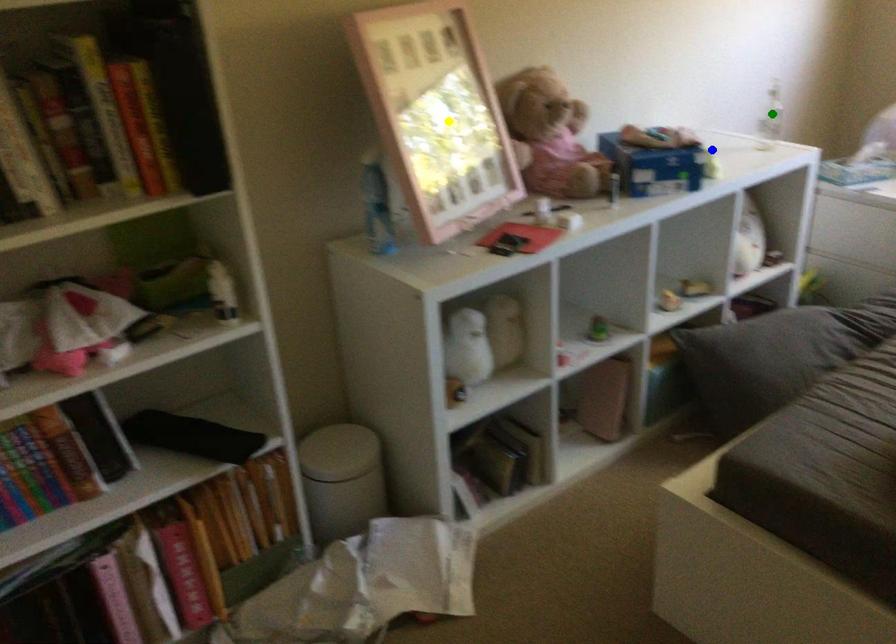
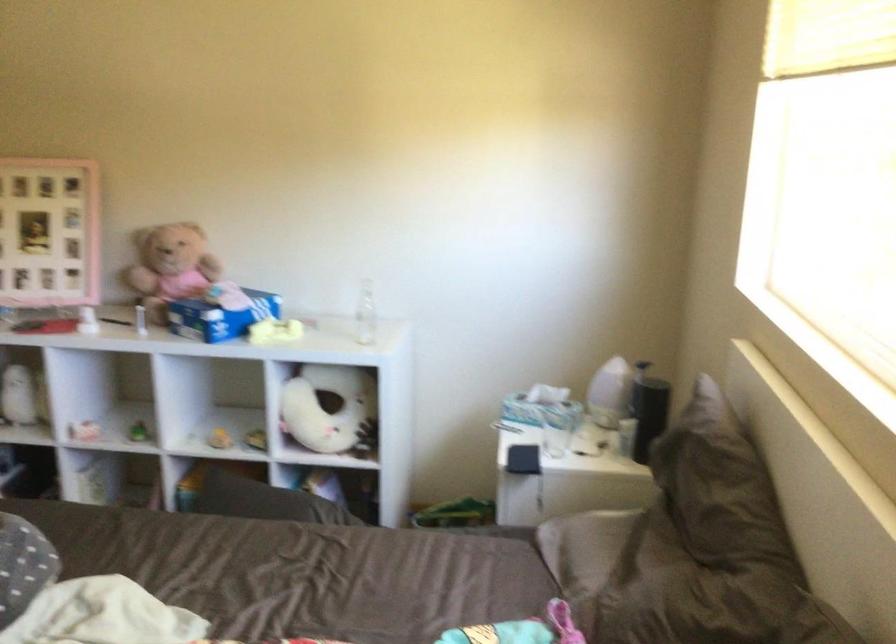
I am providing you with two images of the same scene from different viewpoints. Three points are marked in image1. Which point corresponds to a part or object that is occluded in image2?In image1, three points are marked. Which of them correspond to a part or object that is occluded in image2?Among the three points shown in image1, which one corresponds to a part or object that is no longer visible due to occlusion in image2?

green point